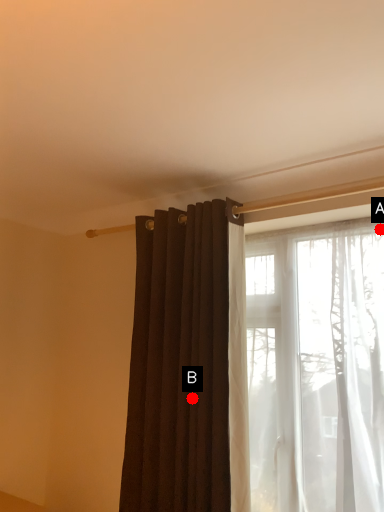
Question: Two points are circled on the image, labeled by A and B beside each circle. Which point is farther to the camera?

Choices:
 (A) A is further
 (B) B is further

Answer: (A)